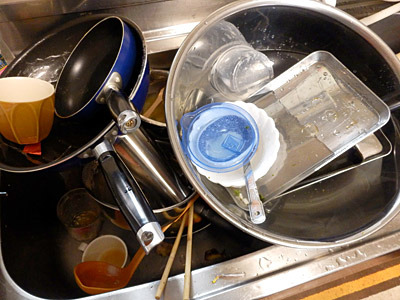
The width and height of the screenshot is (400, 300). What are the coordinates of `inside of sink` in the screenshot? It's located at (55, 237).